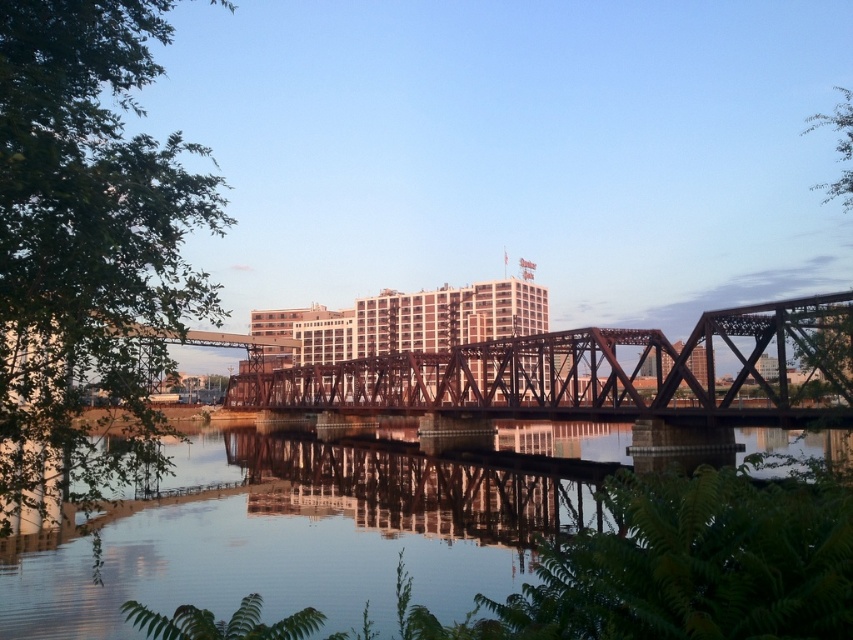
Is clear water at center to the right of rusty metal bridge at center from the viewer's perspective?

No, clear water at center is not to the right of rusty metal bridge at center.

Who is more distant from viewer, (311, 464) or (815, 349)?

The point (311, 464) is behind.

Image resolution: width=853 pixels, height=640 pixels. I want to click on clear water at center, so [x=299, y=538].